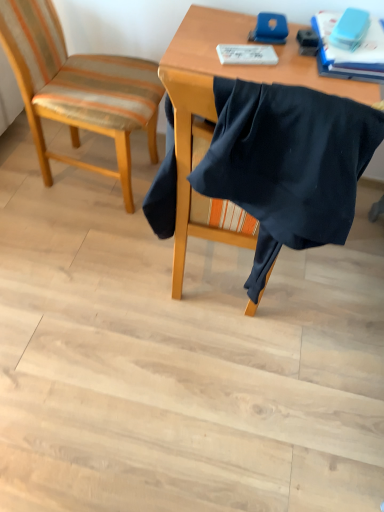
Question: Is white paper at upper center further to the viewer compared to blue matte book at upper right?

Choices:
 (A) yes
 (B) no

Answer: (A)

Question: Considering the relative positions of white paper at upper center and blue matte book at upper right in the image provided, is white paper at upper center in front of blue matte book at upper right?

Choices:
 (A) yes
 (B) no

Answer: (B)

Question: Is white paper at upper center positioned with its back to blue matte book at upper right?

Choices:
 (A) yes
 (B) no

Answer: (B)

Question: Does white paper at upper center have a lesser width compared to blue matte book at upper right?

Choices:
 (A) yes
 (B) no

Answer: (A)

Question: Can you confirm if white paper at upper center is smaller than blue matte book at upper right?

Choices:
 (A) no
 (B) yes

Answer: (B)

Question: Considering the relative positions of white paper at upper center and blue matte book at upper right in the image provided, is white paper at upper center to the left of blue matte book at upper right from the viewer's perspective?

Choices:
 (A) yes
 (B) no

Answer: (A)

Question: From the image's perspective, is blue matte book at upper right under striped fabric chair at left, placed as the 2th chair when sorted from right to left?

Choices:
 (A) no
 (B) yes

Answer: (A)

Question: Does blue matte book at upper right have a greater height compared to striped fabric chair at left, marked as the first chair in a left-to-right arrangement?

Choices:
 (A) no
 (B) yes

Answer: (A)

Question: Would you say blue matte book at upper right is outside striped fabric chair at left, placed as the 2th chair when sorted from right to left?

Choices:
 (A) no
 (B) yes

Answer: (B)

Question: Would you say blue matte book at upper right contains striped fabric chair at left, marked as the first chair in a left-to-right arrangement?

Choices:
 (A) yes
 (B) no

Answer: (B)

Question: Is blue matte book at upper right shorter than striped fabric chair at left, marked as the first chair in a left-to-right arrangement?

Choices:
 (A) no
 (B) yes

Answer: (B)

Question: Is there a large distance between blue matte book at upper right and striped fabric chair at left, marked as the first chair in a left-to-right arrangement?

Choices:
 (A) no
 (B) yes

Answer: (A)

Question: Are blue matte book at upper right and black fabric at center, the first chair in the right-to-left sequence, far apart?

Choices:
 (A) no
 (B) yes

Answer: (A)